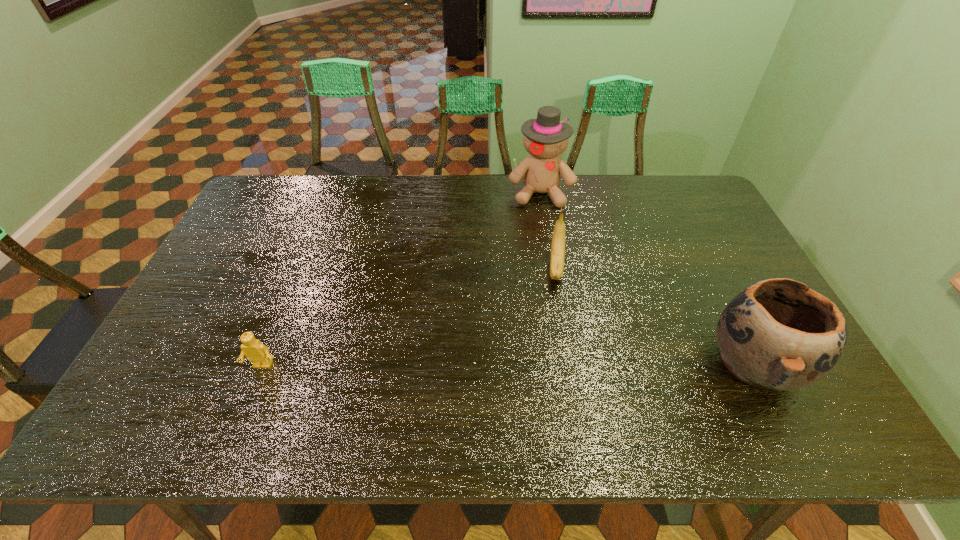
You are a GUI agent. You are given a task and a screenshot of the screen. Output one action in this format:
    pyautogui.click(x=<x>, y=<y>)
    Task: Click on the vacant region at the far edge
    This screenshot has height=540, width=960.
    Given the screenshot: What is the action you would take?
    pyautogui.click(x=499, y=210)

Identify the location of vacant space at the near edge of the desktop. (466, 377).

In the image, there is a desktop. Identify the location of vacant space at the left edge. (232, 272).

The height and width of the screenshot is (540, 960). I want to click on vacant region at the right edge of the desktop, so click(x=716, y=310).

Where is `vacant space at the far right corner of the desktop`? Image resolution: width=960 pixels, height=540 pixels. vacant space at the far right corner of the desktop is located at coordinates (694, 202).

Locate an element on the screen. The image size is (960, 540). blank region between the third tallest object and the tallest object is located at coordinates (548, 230).

Where is `free space between the second shortest object and the second tallest object`? Image resolution: width=960 pixels, height=540 pixels. free space between the second shortest object and the second tallest object is located at coordinates (656, 316).

You are a GUI agent. You are given a task and a screenshot of the screen. Output one action in this format:
    pyautogui.click(x=<x>, y=<y>)
    Task: Click on the free space between the pottery and the rag_doll
    The height and width of the screenshot is (540, 960).
    Given the screenshot: What is the action you would take?
    pyautogui.click(x=648, y=279)

Identify the location of free space between the pottery and the second farthest object. The height and width of the screenshot is (540, 960). (656, 316).

The image size is (960, 540). In order to click on vacant space that's between the third nearest object and the tallest object in this screenshot , I will do `click(548, 230)`.